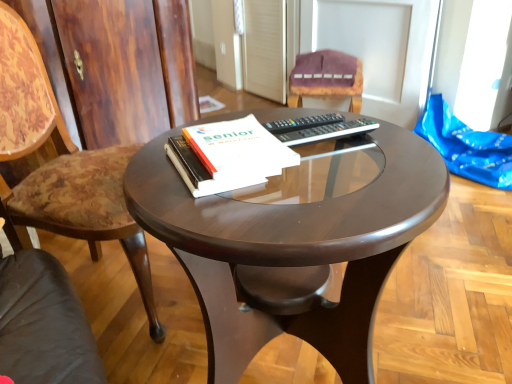
Where is `vacant space positioned to the left of white paper at center`? Image resolution: width=512 pixels, height=384 pixels. vacant space positioned to the left of white paper at center is located at coordinates (154, 167).